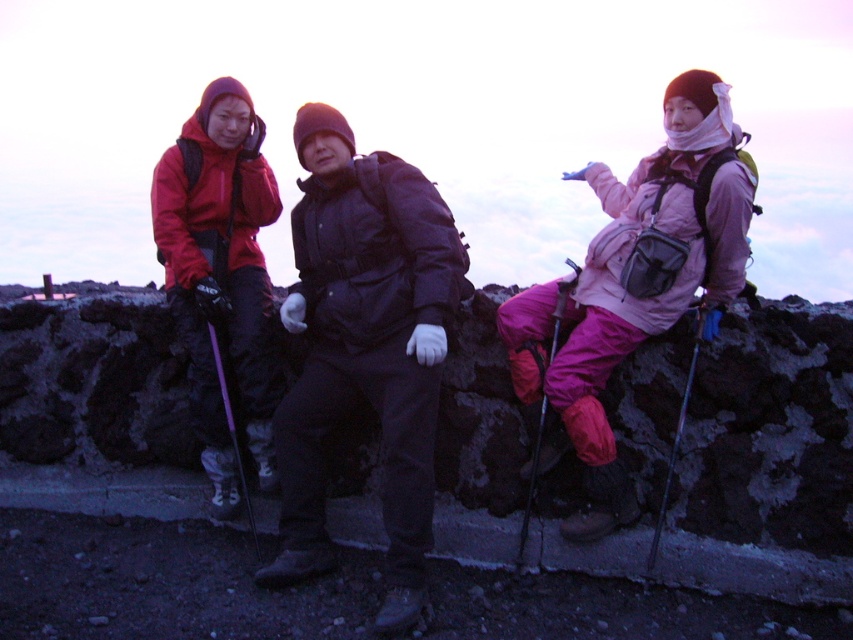
Question: Does metallic silver ski pole at center have a smaller size compared to purple plastic ski pole at center?

Choices:
 (A) yes
 (B) no

Answer: (B)

Question: Is matte black jacket at center below metallic silver ski pole at right?

Choices:
 (A) yes
 (B) no

Answer: (B)

Question: Which object is positioned closest to the metallic silver ski pole at right?

Choices:
 (A) metallic silver ski pole at center
 (B) purple plastic ski pole at center
 (C) matte black jacket at center

Answer: (A)

Question: Which point is closer to the camera taking this photo?

Choices:
 (A) (575, 284)
 (B) (692, 364)

Answer: (B)

Question: Can you confirm if matte black jacket at center is positioned to the right of purple plastic ski pole at center?

Choices:
 (A) no
 (B) yes

Answer: (B)

Question: Which point appears farthest from the camera in this image?

Choices:
 (A) (326, 216)
 (B) (563, 296)
 (C) (688, 380)

Answer: (B)